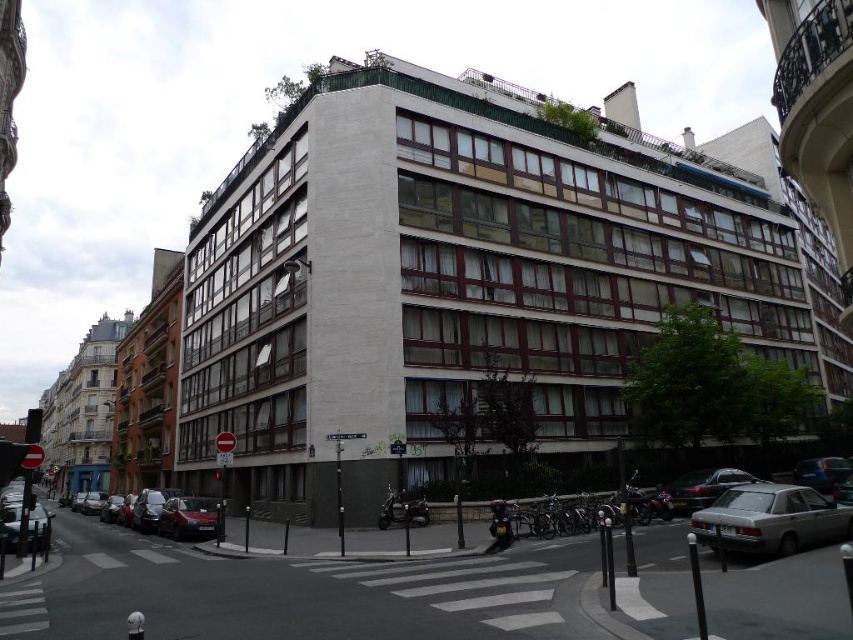
You are a delivery person who needs to park your van between the dark red matte car at lower left and the metallic silver car at lower right. Considering their heights, which car should you position your van closer to to ensure enough clearance for your vehicle?

You should position your van closer to the metallic silver car at lower right because it is shorter than the dark red matte car at lower left, providing more vertical space for the van.

You are a pedestrian crossing the street and see the dark red matte car at lower left and the metallic silver car at lower right. Which car is closer to the left side of the road?

The dark red matte car at lower left is closer to the left side of the road because it is positioned to the left of the metallic silver car at lower right.